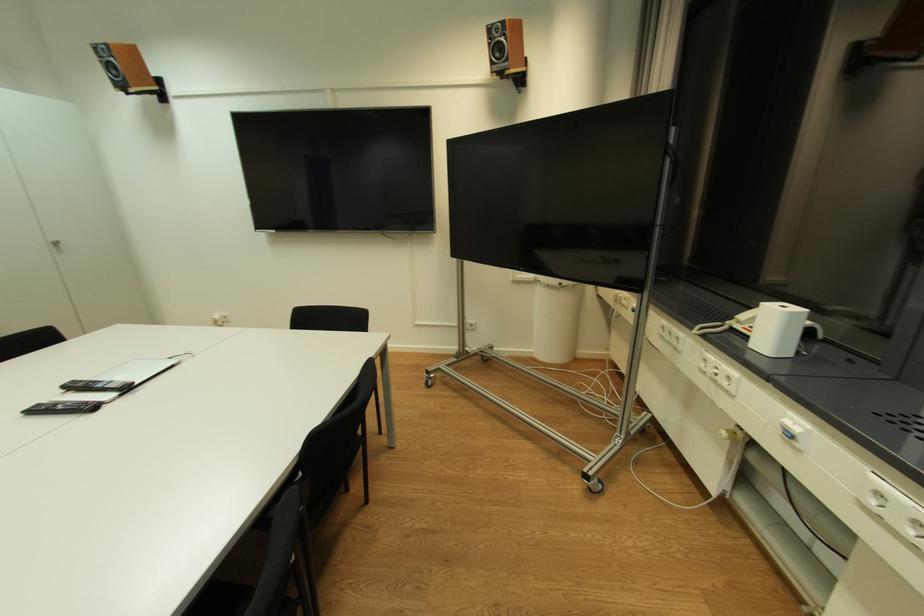
Describe the element at coordinates (55, 245) in the screenshot. I see `a silver door handle` at that location.